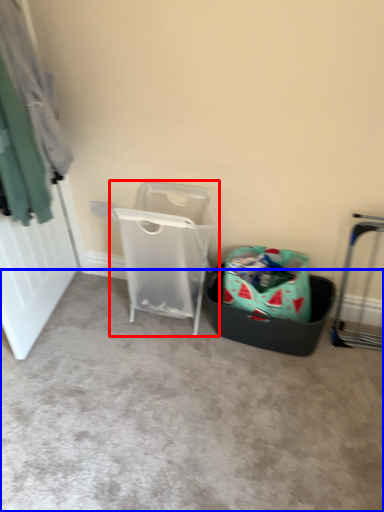
Question: Which of the following is the farthest to the observer, waste container (highlighted by a red box) or concrete (highlighted by a blue box)?

Choices:
 (A) waste container
 (B) concrete

Answer: (A)